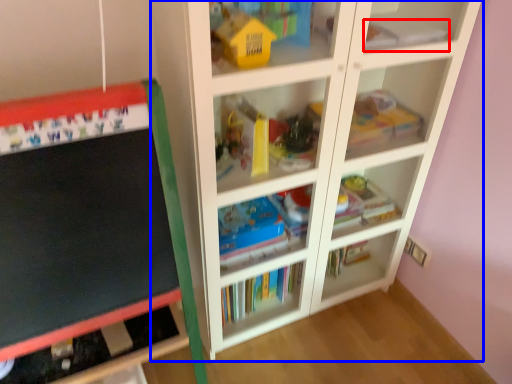
Question: Which of the following is the farthest to the observer, book (highlighted by a red box) or shelf (highlighted by a blue box)?

Choices:
 (A) book
 (B) shelf

Answer: (A)